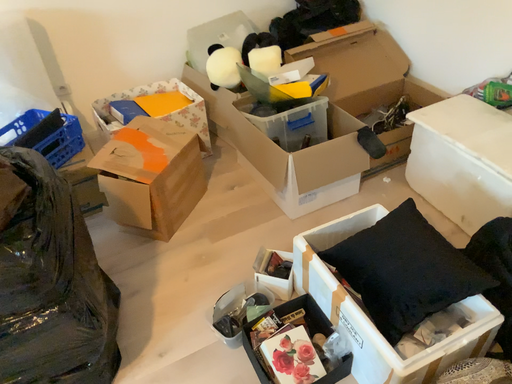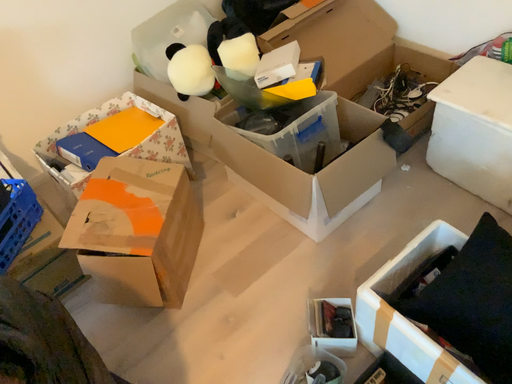
Question: How did the camera likely rotate when shooting the video?

Choices:
 (A) rotated right
 (B) rotated left

Answer: (A)